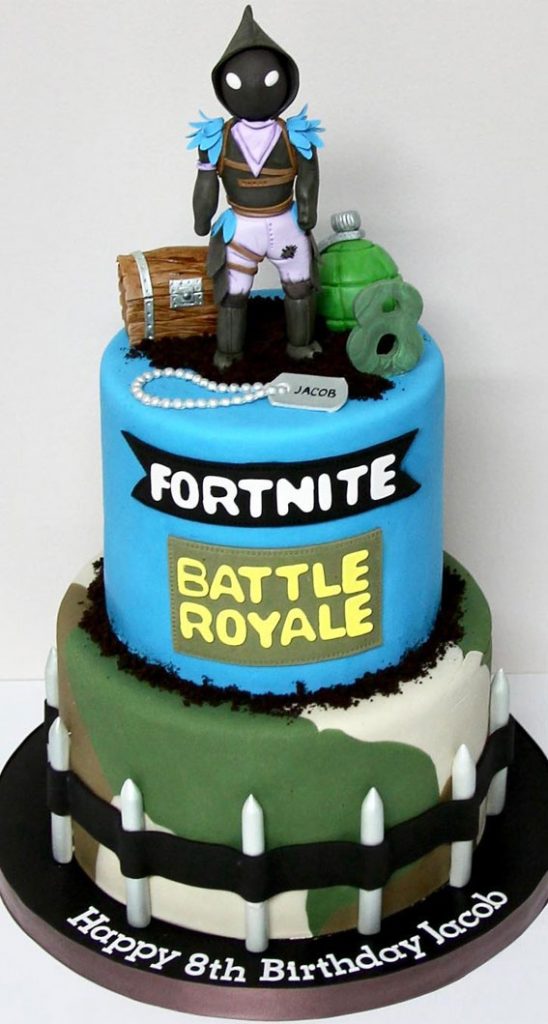
This screenshot has height=1024, width=548. What are the coordinates of `table` in the screenshot? It's located at (501, 993), (56, 993), (26, 721), (525, 702).